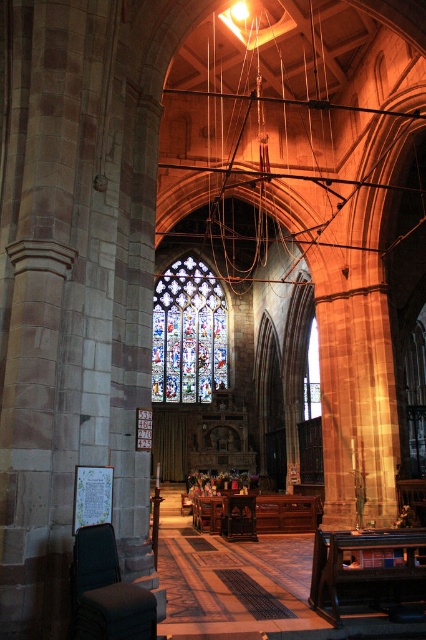
Question: Is wooden polished chair at center thinner than stained glass at center?

Choices:
 (A) no
 (B) yes

Answer: (B)

Question: Does stained glass window at center have a lesser width compared to wooden polished chair at center?

Choices:
 (A) yes
 (B) no

Answer: (B)

Question: Does stained glass window at center have a greater width compared to stained glass at center?

Choices:
 (A) no
 (B) yes

Answer: (B)

Question: Which of the following is the farthest from the observer?

Choices:
 (A) (80, 528)
 (B) (241, 502)
 (C) (310, 330)
 (D) (187, 371)

Answer: (D)

Question: Which object is the farthest from the wooden polished chair at center?

Choices:
 (A) stained glass at center
 (B) stained glass window at center

Answer: (B)

Question: Which point is farther from the camera taking this photo?

Choices:
 (A) (244, 496)
 (B) (317, 355)
 (C) (190, 337)

Answer: (B)